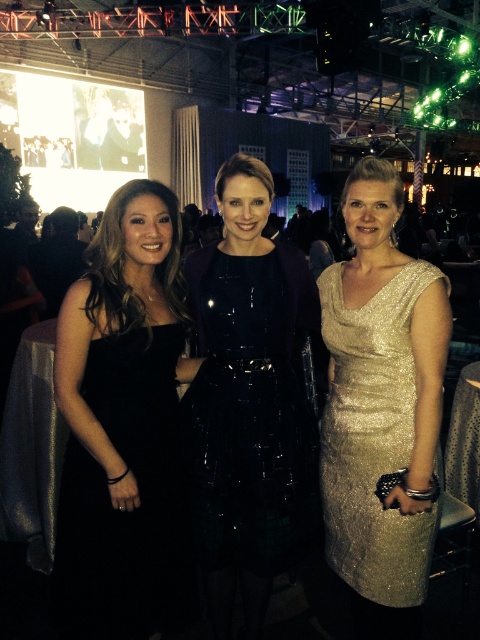
You are a photographer at the event and need to capture both the black satin dress at left and the gold sequined dress at right in a single frame. Based on their positions, which dress should you focus on first to ensure both are in the shot?

The black satin dress at left is to the left of the gold sequined dress at right, so focusing on the black satin dress at left first will allow you to frame both dresses in the shot since they are positioned side by side from left to right.

You are a photographer at this event and need to capture a photo of both the glossy black dress at center and the gold sequined dress at right. Since you want both dresses to appear equally prominent in the photo, which dress should you position closer to the camera?

The glossy black dress at center is taller than the gold sequined dress at right, so to make both appear equally prominent in the photo, you should position the gold sequined dress at right closer to the camera.

You are a photographer positioned at the center of the room. You want to take a photo of the black satin dress at left and the large screen in the background. Can you fit both in your shot without moving your position? Please explain based on their distance apart.

The black satin dress at left and the large screen in the background are 5.53 feet apart. Since they are relatively close to each other, you can likely fit both in your shot without moving your position.